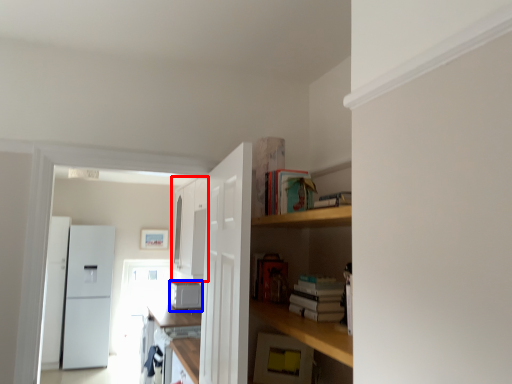
Question: Which of the following is the closest to the observer, cabinetry (highlighted by a red box) or appliance (highlighted by a blue box)?

Choices:
 (A) cabinetry
 (B) appliance

Answer: (A)